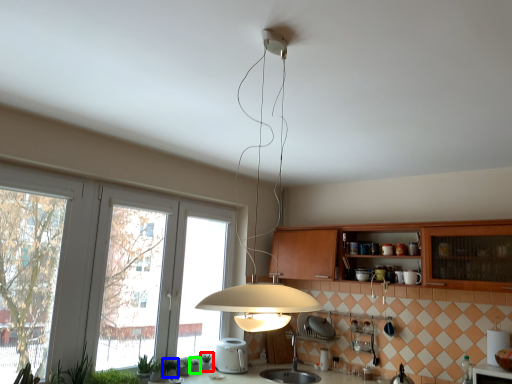
Question: Considering the real-world distances, which object is farthest from plant (highlighted by a red box)? plant (highlighted by a blue box) or plant (highlighted by a green box)?

Choices:
 (A) plant
 (B) plant

Answer: (A)